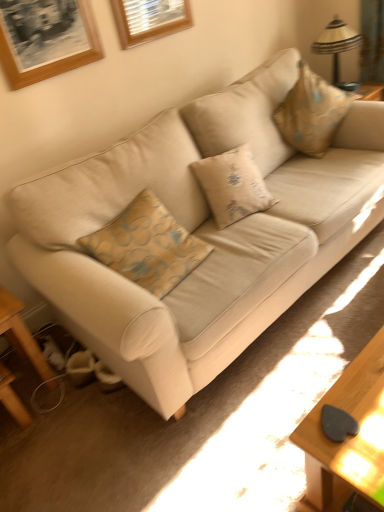
The height and width of the screenshot is (512, 384). What are the coordinates of `vacant area that lies in front of wooden table at lower left` in the screenshot? It's located at (43, 445).